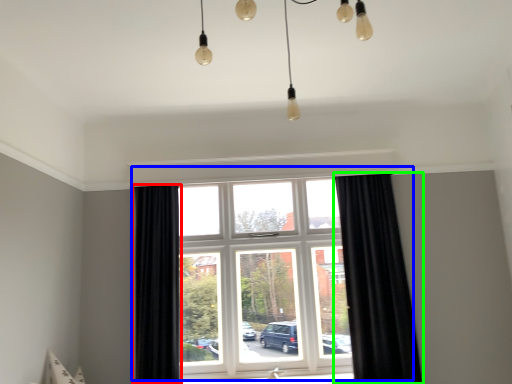
Question: Which is nearer to the curtain (highlighted by a red box)? window (highlighted by a blue box) or curtain (highlighted by a green box).

Choices:
 (A) window
 (B) curtain

Answer: (A)